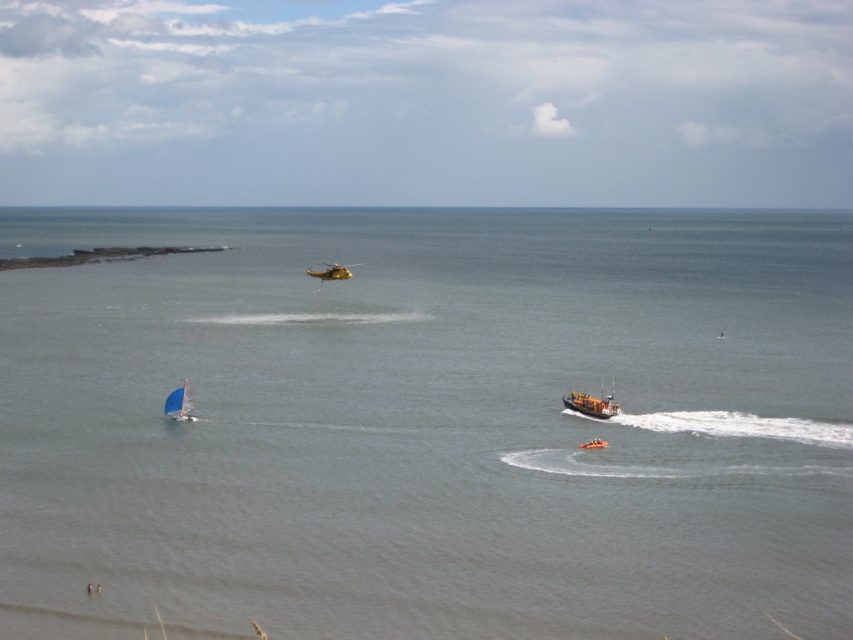
Question: Which is nearer to the orange metallic lifeboat at center?

Choices:
 (A) blue sailboat at lower left
 (B) brown coral reef at upper left
 (C) gray water at center

Answer: (A)

Question: Is brown coral reef at upper left to the left of orange metallic lifeboat at center from the viewer's perspective?

Choices:
 (A) no
 (B) yes

Answer: (B)

Question: Which of these objects is positioned closest to the gray water at center?

Choices:
 (A) yellow rubber dinghy at center
 (B) yellow matte helicopter at upper center
 (C) orange metallic lifeboat at center
 (D) blue sailboat at lower left

Answer: (B)

Question: Is orange metallic lifeboat at center below yellow rubber dinghy at center?

Choices:
 (A) no
 (B) yes

Answer: (A)

Question: Does brown coral reef at upper left appear on the right side of yellow rubber dinghy at center?

Choices:
 (A) yes
 (B) no

Answer: (B)

Question: Which object appears farthest from the camera in this image?

Choices:
 (A) yellow matte helicopter at upper center
 (B) orange metallic lifeboat at center

Answer: (A)